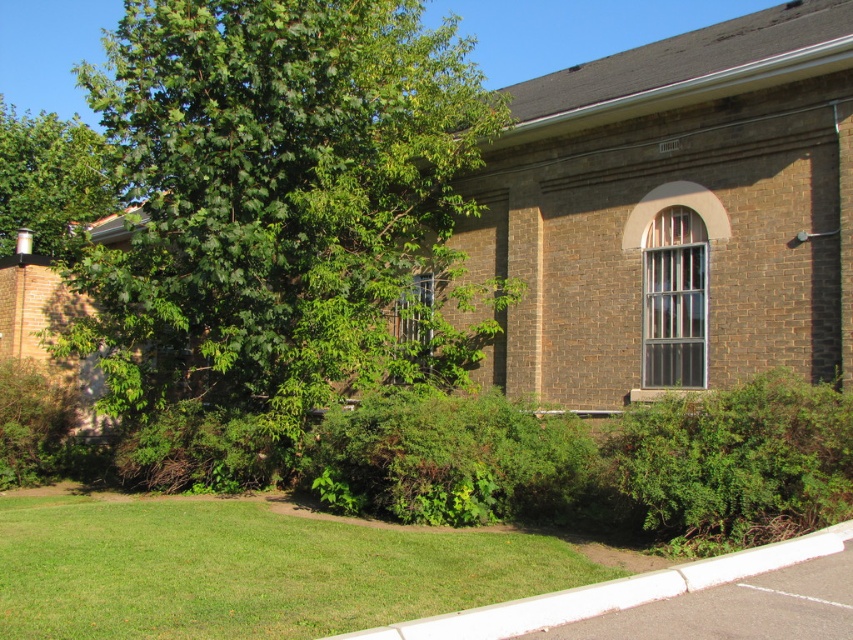
Which is more to the left, green leafy bush at lower right or green leafy bush at center?

Positioned to the left is green leafy bush at center.

Locate an element on the screen. The image size is (853, 640). green leafy bush at lower right is located at coordinates (735, 464).

Who is more distant from viewer, (252, 515) or (698, 579)?

Point (252, 515)

Is green grass at lower center above white concrete curb at lower center?

Incorrect, green grass at lower center is not positioned above white concrete curb at lower center.

Who is more distant from viewer, (x=239, y=592) or (x=833, y=538)?

Positioned behind is point (x=833, y=538).

You are a GUI agent. You are given a task and a screenshot of the screen. Output one action in this format:
    pyautogui.click(x=<x>, y=<y>)
    Task: Click on the green grass at lower center
    
    Given the screenshot: What is the action you would take?
    pyautogui.click(x=248, y=570)

Who is higher up, green grass at lower center or green leafy bush at center?

green leafy bush at center is higher up.

What do you see at coordinates (248, 570) in the screenshot? I see `green grass at lower center` at bounding box center [248, 570].

Measure the distance between point (502, 547) and camera.

7.51 meters

Where is `green grass at lower center`? Image resolution: width=853 pixels, height=640 pixels. green grass at lower center is located at coordinates (248, 570).